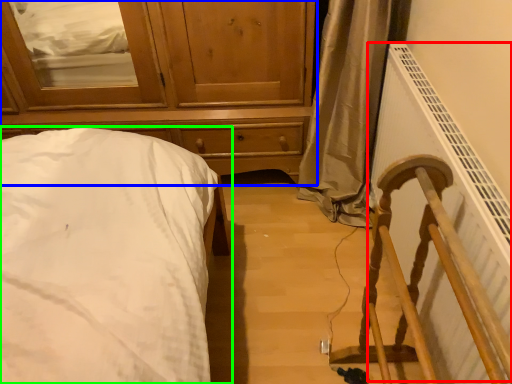
Question: Based on their relative distances, which object is farther from radiator (highlighted by a red box)? Choose from chest of drawers (highlighted by a blue box) and bed (highlighted by a green box).

Choices:
 (A) chest of drawers
 (B) bed

Answer: (B)